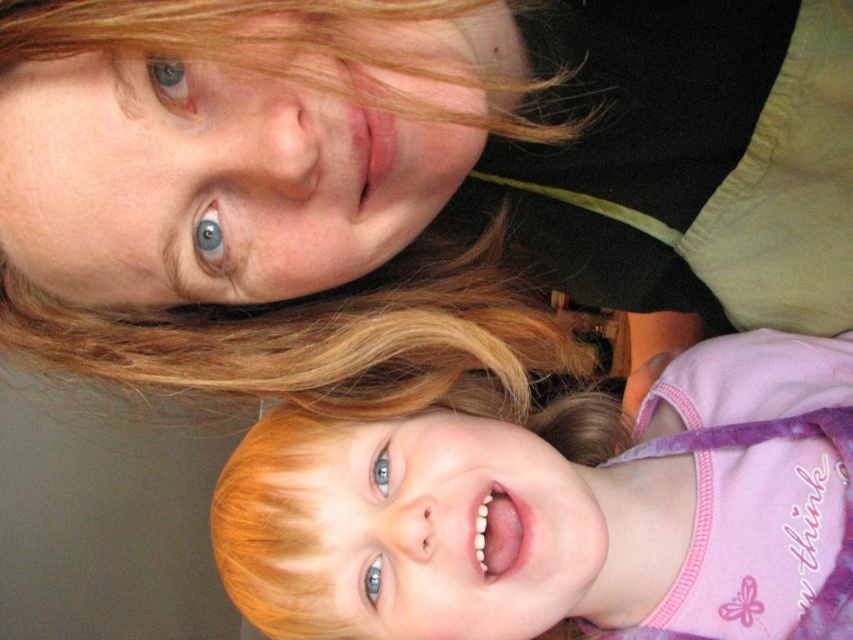
Question: Which object is closer to the camera taking this photo?

Choices:
 (A) blonde hair at upper left
 (B) smooth blonde hair at lower center

Answer: (A)

Question: Is smooth blonde hair at lower center positioned before blonde hair at upper left?

Choices:
 (A) no
 (B) yes

Answer: (A)

Question: Which of the following is the closest to the observer?

Choices:
 (A) blonde hair at upper left
 (B) smooth blonde hair at lower center

Answer: (A)

Question: Can you confirm if smooth blonde hair at lower center is positioned below blonde hair at upper left?

Choices:
 (A) no
 (B) yes

Answer: (B)

Question: Is smooth blonde hair at lower center above blonde hair at upper left?

Choices:
 (A) no
 (B) yes

Answer: (A)